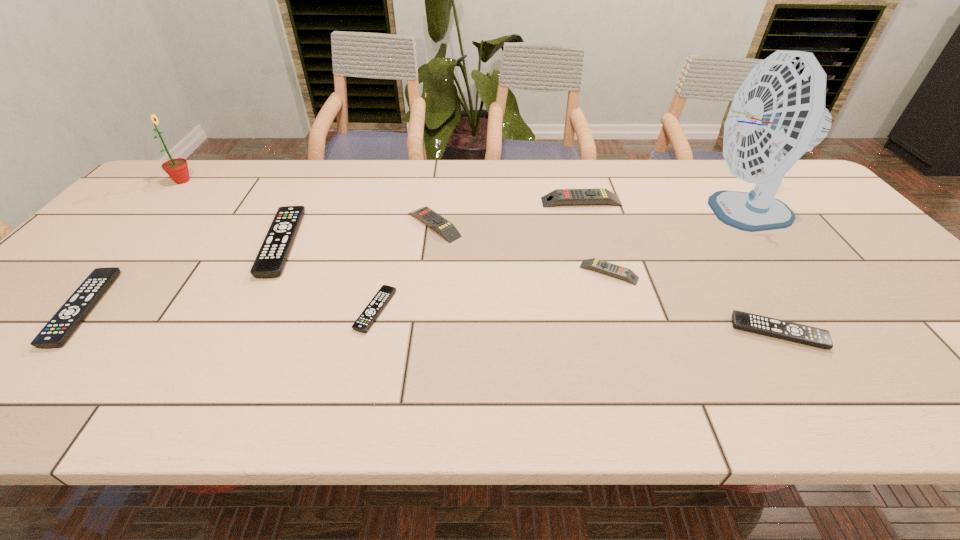
Locate an element on the screen. the fifth closest object to the smallest yellow remote control is located at coordinates (379, 301).

Locate which remote control is the second closest to the second biggest black remote control. Please provide its 2D coordinates. Your answer should be formatted as a tuple, i.e. [(x, y)], where the tuple contains the x and y coordinates of a point satisfying the conditions above.

[(379, 301)]

This screenshot has height=540, width=960. I want to click on remote control that stands as the fifth closest to the second biggest yellow remote control, so click(x=804, y=334).

Find the location of a particular element. This screenshot has height=540, width=960. yellow remote control that is the closest to the green sunflower is located at coordinates (446, 229).

Locate which yellow remote control ranks second in proximity to the shortest object. Please provide its 2D coordinates. Your answer should be formatted as a tuple, i.e. [(x, y)], where the tuple contains the x and y coordinates of a point satisfying the conditions above.

[(617, 271)]

Select which black remote control is the second closest to the farthest remote control. Please provide its 2D coordinates. Your answer should be formatted as a tuple, i.e. [(x, y)], where the tuple contains the x and y coordinates of a point satisfying the conditions above.

[(379, 301)]

What are the coordinates of `black remote control that is the second closest to the leftmost remote control` in the screenshot? It's located at (379, 301).

Where is `vacant space that satisfies the following two spatial constraints: 1. on the face of the sunflower; 2. on the back side of the rightmost remote control`? The image size is (960, 540). vacant space that satisfies the following two spatial constraints: 1. on the face of the sunflower; 2. on the back side of the rightmost remote control is located at coordinates (40, 333).

You are a GUI agent. You are given a task and a screenshot of the screen. Output one action in this format:
    pyautogui.click(x=<x>, y=<y>)
    Task: Click on the free space that satisfies the following two spatial constraints: 1. on the face of the sunflower; 2. on the right side of the second biggest yellow remote control
    The width and height of the screenshot is (960, 540).
    Given the screenshot: What is the action you would take?
    pyautogui.click(x=141, y=225)

Locate an element on the screen. free space that satisfies the following two spatial constraints: 1. on the front side of the smallest yellow remote control; 2. on the left side of the second smallest black remote control is located at coordinates (628, 333).